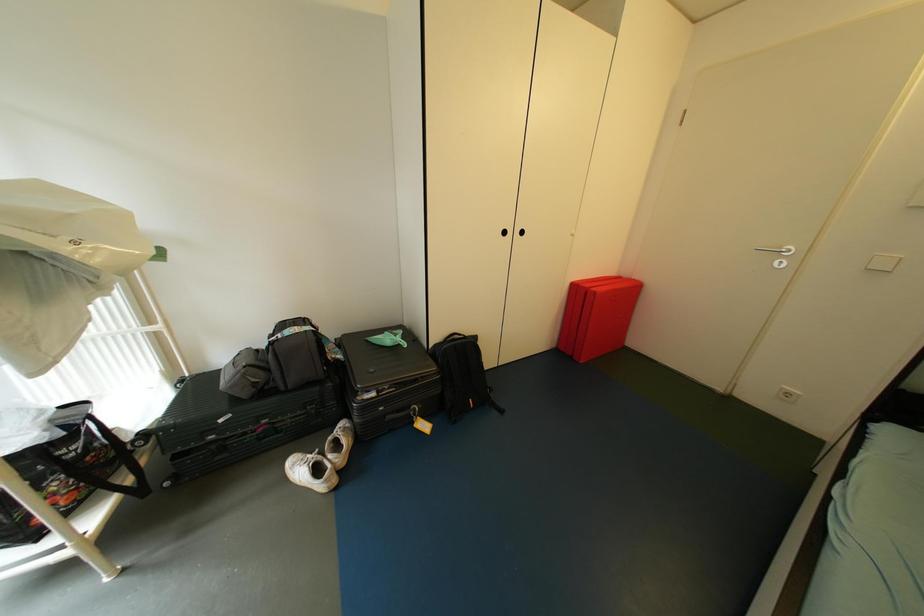
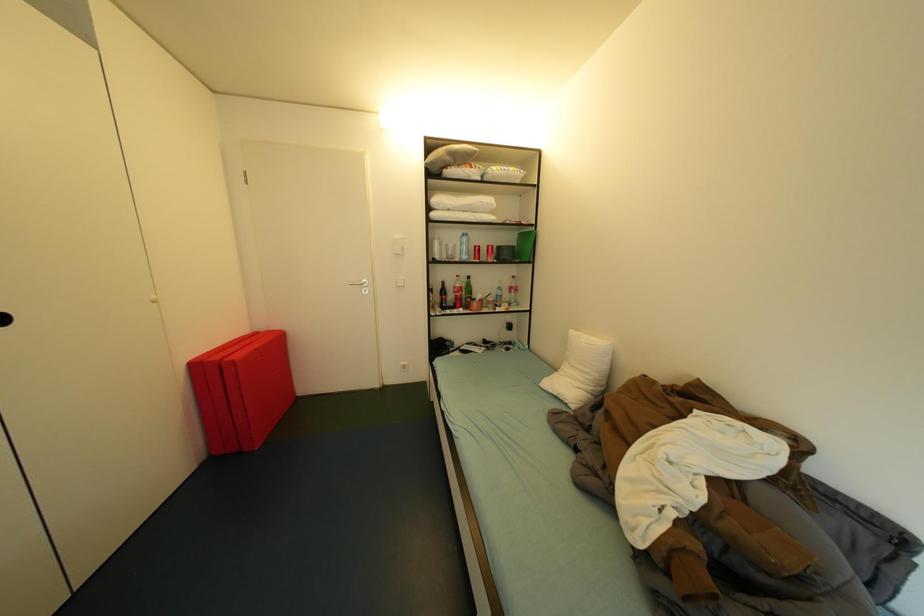
Question: Based on the continuous images, in which direction is the camera rotating? Reply with the corresponding letter.

Choices:
 (A) Left
 (B) Right
 (C) Up
 (D) Down

Answer: (B)